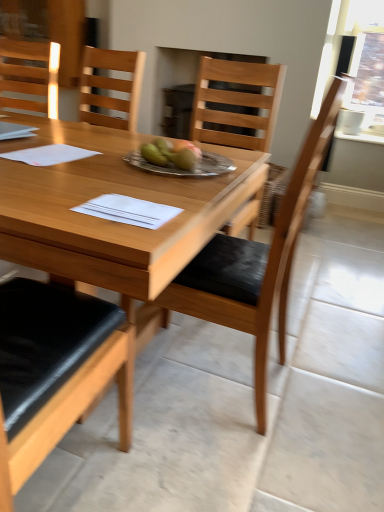
This screenshot has width=384, height=512. I want to click on free point in front of silver metallic plate at center, so click(162, 183).